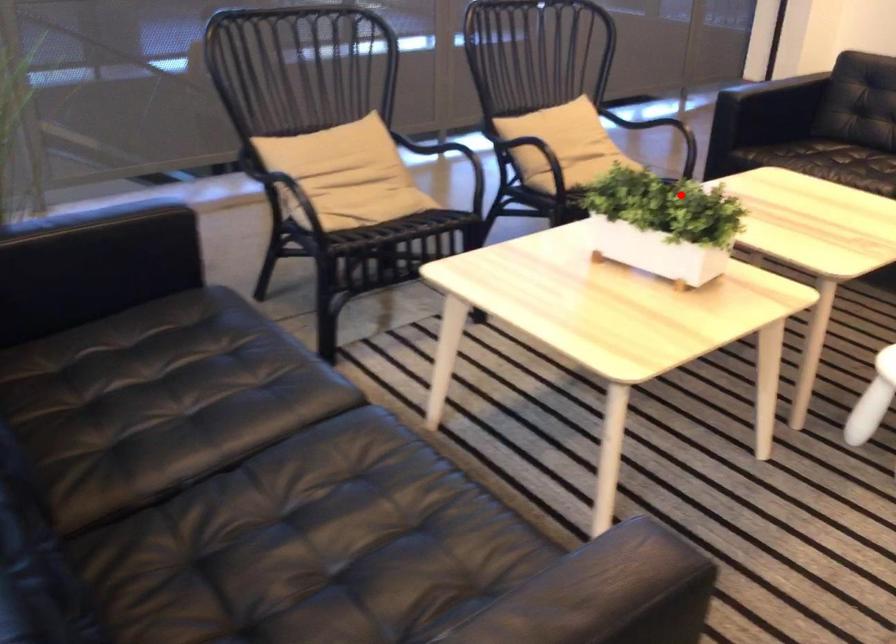
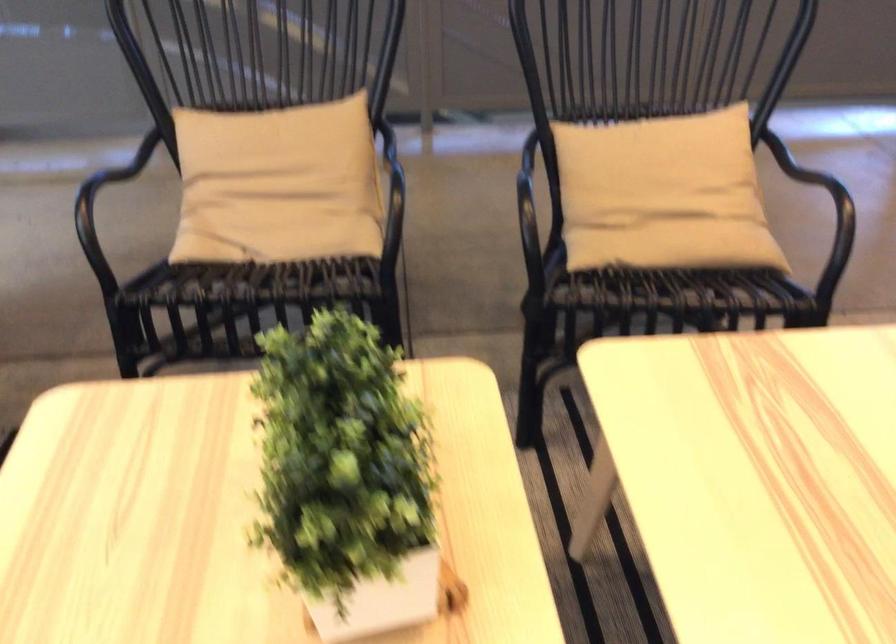
In the second image, find the point that corresponds to the highlighted location in the first image.

(346, 477)